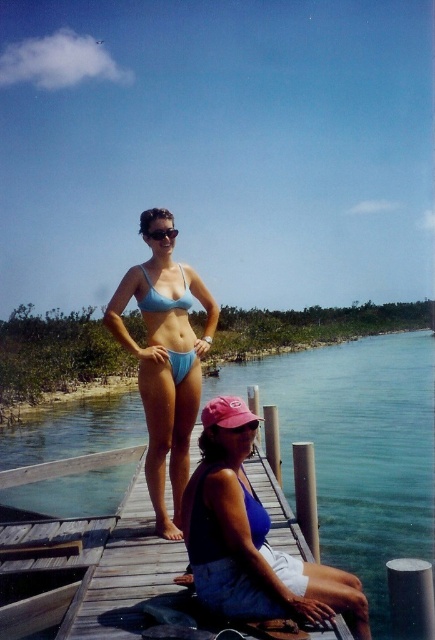
In the scene shown: You are taking a photo of the two points on the dock. Which point, point (247, 577) or point (170, 301), will appear larger in the photo?

Point (247, 577) is closer to the camera than point (170, 301), so it will appear larger in the photo.

Based on the coordinates provided, which object in the scene is located at point (x=358, y=445)?

The clear blue water at center is located at point (x=358, y=445).

You are planning to take a photo of the clear blue water at center and the wooden at center. Which object should you focus on first if you want to capture both in one frame without moving the camera?

You should focus on the clear blue water at center first because it is larger in size than the wooden at center, making it the dominant subject in the frame.